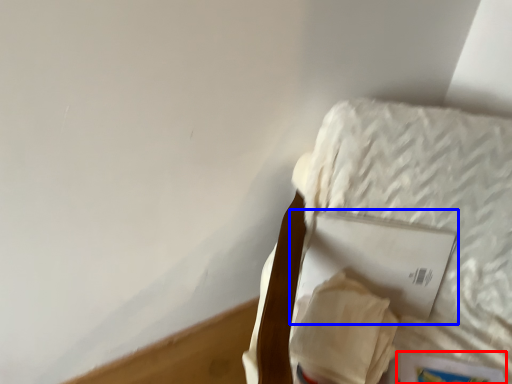
Question: Among these objects, which one is farthest to the camera, paperback book (highlighted by a red box) or paperback book (highlighted by a blue box)?

Choices:
 (A) paperback book
 (B) paperback book

Answer: (B)